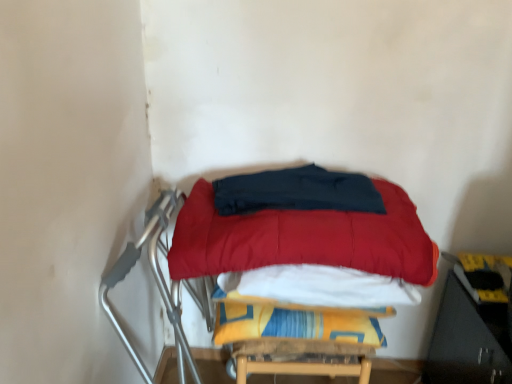
Question: Can we say yellow fabric blanket at center, the 2th blanket when ordered from top to bottom, lies outside velvet red mattress at center?

Choices:
 (A) yes
 (B) no

Answer: (A)

Question: Considering the relative sizes of yellow fabric blanket at center, the 2th blanket when ordered from top to bottom, and velvet red mattress at center in the image provided, is yellow fabric blanket at center, the 2th blanket when ordered from top to bottom, wider than velvet red mattress at center?

Choices:
 (A) yes
 (B) no

Answer: (B)

Question: From the image's perspective, is yellow fabric blanket at center, the 2th blanket when ordered from top to bottom, beneath velvet red mattress at center?

Choices:
 (A) yes
 (B) no

Answer: (A)

Question: Is yellow fabric blanket at center, the 2th blanket when ordered from top to bottom, at the right side of velvet red mattress at center?

Choices:
 (A) yes
 (B) no

Answer: (B)

Question: Could velvet red mattress at center be considered to be inside yellow fabric blanket at center, marked as the first blanket in a bottom-to-top arrangement?

Choices:
 (A) yes
 (B) no

Answer: (B)

Question: Is velvet red mattress at center to the left or to the right of yellow fabric blanket at center, marked as the first blanket in a bottom-to-top arrangement, in the image?

Choices:
 (A) right
 (B) left

Answer: (A)

Question: From the image's perspective, relative to yellow fabric blanket at center, marked as the first blanket in a bottom-to-top arrangement, is velvet red mattress at center above or below?

Choices:
 (A) below
 (B) above

Answer: (B)

Question: Is velvet red mattress at center spatially inside yellow fabric blanket at center, the 2th blanket when ordered from top to bottom, or outside of it?

Choices:
 (A) inside
 (B) outside

Answer: (B)

Question: In terms of width, does velvet red mattress at center look wider or thinner when compared to yellow fabric blanket at center, the 2th blanket when ordered from top to bottom?

Choices:
 (A) wide
 (B) thin

Answer: (A)

Question: In terms of size, does dark blue fabric at center, the first blanket when ordered from top to bottom, appear bigger or smaller than velvet red mattress at center?

Choices:
 (A) big
 (B) small

Answer: (B)

Question: Considering their positions, is dark blue fabric at center, the first blanket when ordered from top to bottom, located in front of or behind velvet red mattress at center?

Choices:
 (A) front
 (B) behind

Answer: (B)

Question: Looking at their shapes, would you say dark blue fabric at center, placed as the 2th blanket when sorted from bottom to top, is wider or thinner than velvet red mattress at center?

Choices:
 (A) thin
 (B) wide

Answer: (A)

Question: From the image's perspective, is dark blue fabric at center, the first blanket when ordered from top to bottom, located above or below velvet red mattress at center?

Choices:
 (A) below
 (B) above

Answer: (B)

Question: Is dark blue fabric at center, the first blanket when ordered from top to bottom, bigger or smaller than yellow fabric blanket at center, the 2th blanket when ordered from top to bottom?

Choices:
 (A) small
 (B) big

Answer: (A)

Question: From a real-world perspective, is dark blue fabric at center, placed as the 2th blanket when sorted from bottom to top, positioned above or below yellow fabric blanket at center, marked as the first blanket in a bottom-to-top arrangement?

Choices:
 (A) above
 (B) below

Answer: (A)